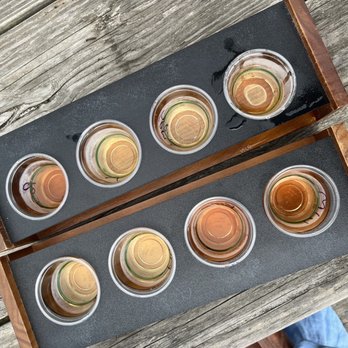
This screenshot has height=348, width=348. Identify the location of plastic cup. (14, 170).